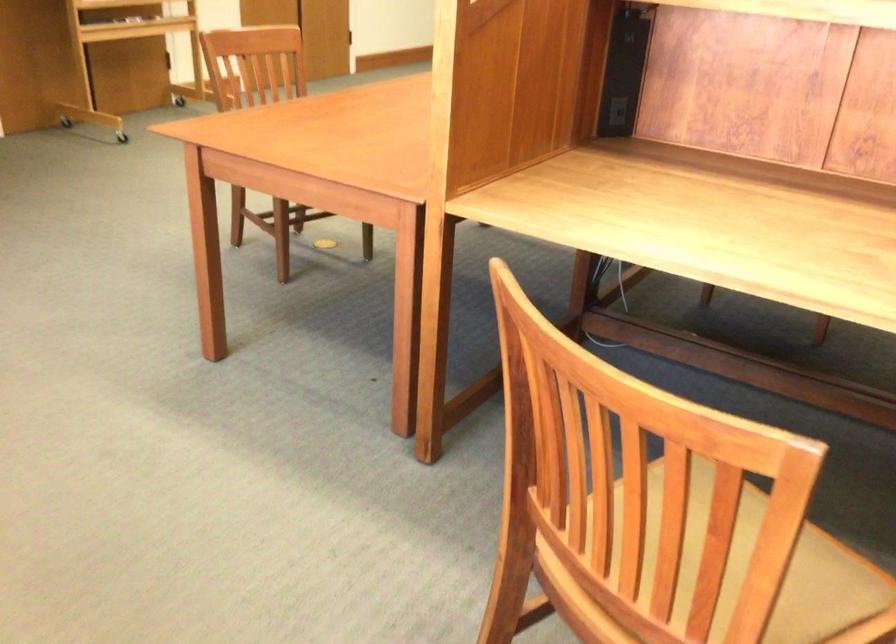
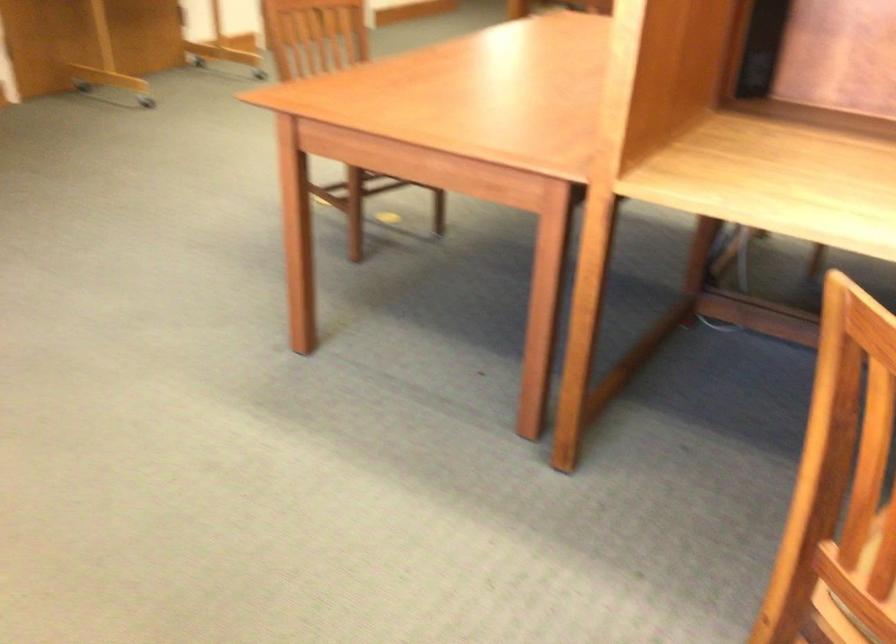
What movement of the cameraman would produce the second image?

The movement direction of the cameraman is left, forward.